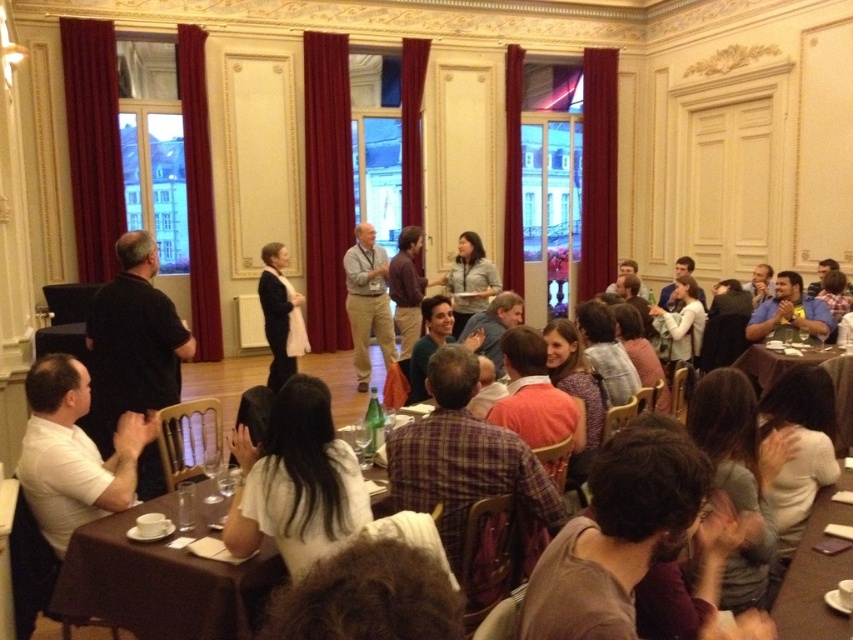
Is point (155, 508) positioned after point (364, 241)?

No, (155, 508) is in front of (364, 241).

Consider the image. Is brown fabric table at lower center thinner than light gray shirt at center?

In fact, brown fabric table at lower center might be wider than light gray shirt at center.

I want to click on brown fabric table at lower center, so click(x=160, y=582).

Locate an element on the screen. The height and width of the screenshot is (640, 853). brown fabric table at lower center is located at coordinates (160, 582).

Who is more forward, (361, 337) or (840, 428)?

Point (840, 428)

Between light gray shirt at center and brown wooden table at lower right, which one is positioned lower?

Positioned lower is brown wooden table at lower right.

The height and width of the screenshot is (640, 853). I want to click on light gray shirt at center, so click(x=367, y=301).

This screenshot has height=640, width=853. Find the location of `light gray shirt at center`. light gray shirt at center is located at coordinates (367, 301).

Can you confirm if brown fabric table at lower center is bigger than brown wooden table at lower right?

No.

Where is `brown fabric table at lower center`? The height and width of the screenshot is (640, 853). brown fabric table at lower center is located at coordinates (160, 582).

Where is `brown fabric table at lower center`? brown fabric table at lower center is located at coordinates (160, 582).